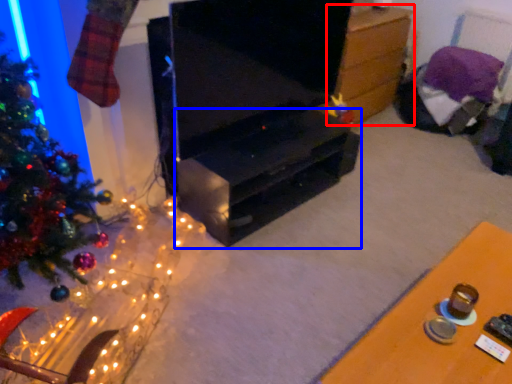
Question: Which object is closer to the camera taking this photo, table (highlighted by a red box) or tv cabinet (highlighted by a blue box)?

Choices:
 (A) table
 (B) tv cabinet

Answer: (B)